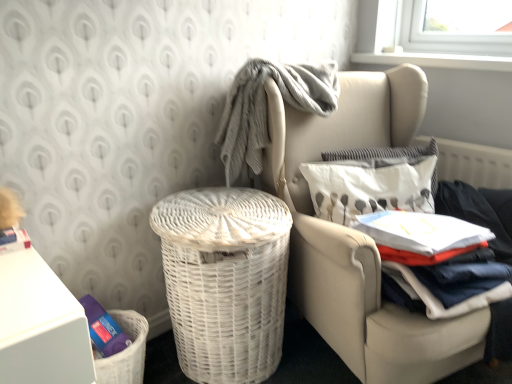
Question: In terms of height, does white textured pillow at upper right, which is counted as the 1th pillow, starting from the back, look taller or shorter compared to white wicker basket at center-left?

Choices:
 (A) short
 (B) tall

Answer: (A)

Question: Would you say white textured pillow at upper right, which is counted as the 1th pillow, starting from the back, is to the left or to the right of white wicker basket at center-left in the picture?

Choices:
 (A) right
 (B) left

Answer: (A)

Question: Estimate the real-world distances between objects in this image. Which object is farther from the white wicker chair at center?

Choices:
 (A) white textured pillow at upper right, the 2th pillow in the back-to-front sequence
 (B) gray textured blanket at upper center
 (C) white textured pillow at upper right, placed as the 2th pillow when sorted from front to back
 (D) white cotton shirt at right
 (E) white wicker basket at center-left

Answer: (C)

Question: Based on their relative distances, which object is nearer to the white wicker chair at center?

Choices:
 (A) white wicker basket at center-left
 (B) white textured pillow at upper right, placed as the 2th pillow when sorted from front to back
 (C) white textured pillow at upper right, the 2th pillow in the back-to-front sequence
 (D) white cotton shirt at right
 (E) gray textured blanket at upper center

Answer: (C)